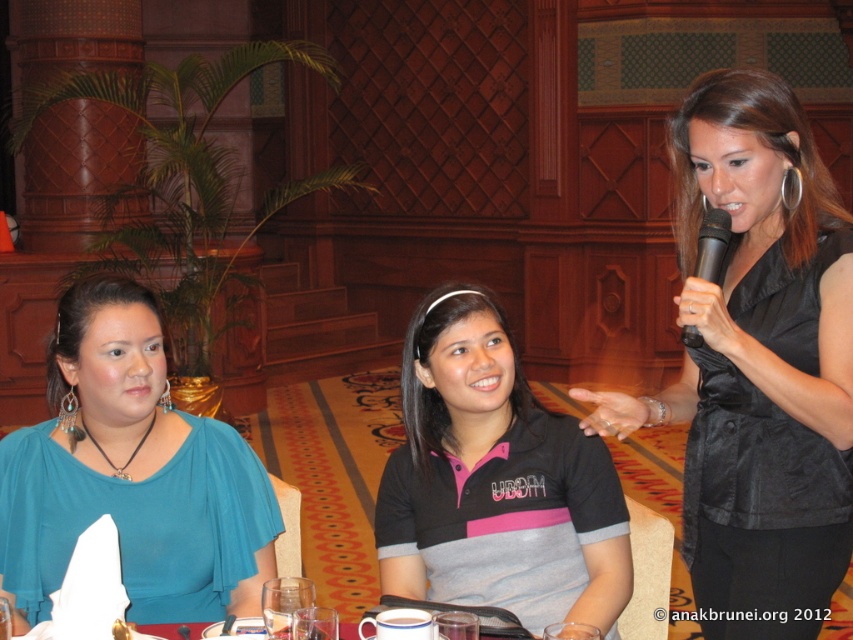
Question: Which is farther from the black satin vest at upper right?

Choices:
 (A) teal fabric blouse at left
 (B) black matte polo shirt at center

Answer: (A)

Question: Which object appears closest to the camera in this image?

Choices:
 (A) teal fabric blouse at left
 (B) black matte polo shirt at center
 (C) black satin vest at upper right
 (D) black plastic microphone at upper right

Answer: (C)

Question: Is teal fabric blouse at left positioned behind black matte polo shirt at center?

Choices:
 (A) no
 (B) yes

Answer: (B)

Question: Does black matte polo shirt at center have a smaller size compared to black plastic microphone at upper right?

Choices:
 (A) no
 (B) yes

Answer: (A)

Question: Among these points, which one is nearest to the camera?

Choices:
 (A) (714, 240)
 (B) (131, 500)

Answer: (A)

Question: Does black satin vest at upper right come in front of black matte polo shirt at center?

Choices:
 (A) yes
 (B) no

Answer: (A)